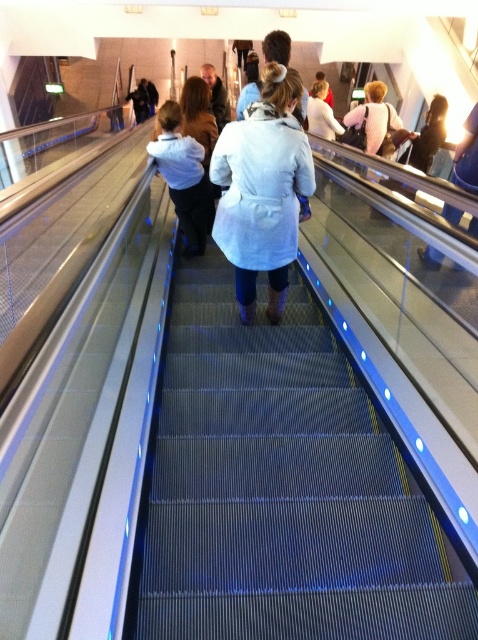
Question: Does light blue denim jacket at center appear under dark brown leather jacket at upper center?

Choices:
 (A) yes
 (B) no

Answer: (A)

Question: Which object appears farthest from the camera in this image?

Choices:
 (A) light brown leather jacket at center
 (B) dark brown leather jacket at upper right
 (C) white matte coat at upper center

Answer: (A)

Question: Which point is farther to the camera?

Choices:
 (A) dark blue jacket at upper center
 (B) white matte coat at upper center
 (C) light blue denim jacket at center

Answer: (A)

Question: In this image, where is light brown leather jacket at upper center located relative to dark brown leather jacket at upper center?

Choices:
 (A) above
 (B) below

Answer: (A)

Question: Which point is farther from the camera taking this photo?

Choices:
 (A) 327,129
 (B) 174,150

Answer: (A)

Question: Does light blue coat at center come behind light blue denim jacket at center?

Choices:
 (A) no
 (B) yes

Answer: (A)